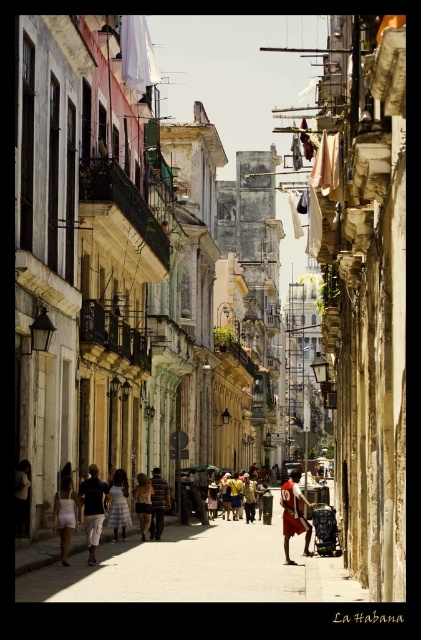
Question: Is red fabric shorts at center wider than white matte dress at center?

Choices:
 (A) no
 (B) yes

Answer: (B)

Question: Estimate the real-world distances between objects in this image. Which object is farther from the matte concrete alley at center?

Choices:
 (A) red fabric shorts at center
 (B) dark brown pants at center

Answer: (B)

Question: Can you confirm if red fabric shorts at center is bigger than dark brown pants at center?

Choices:
 (A) yes
 (B) no

Answer: (A)

Question: Which point is farther to the camera?

Choices:
 (A) matte concrete alley at center
 (B) golden fabric dress at center
 (C) white matte shorts at lower left
 (D) white matte dress at center

Answer: (B)

Question: Is matte concrete alley at center behind white matte shorts at lower left?

Choices:
 (A) yes
 (B) no

Answer: (B)

Question: Among these points, which one is nearest to the camera?

Choices:
 (A) (173, 576)
 (B) (92, 484)
 (C) (60, 502)
 (D) (151, 513)

Answer: (A)